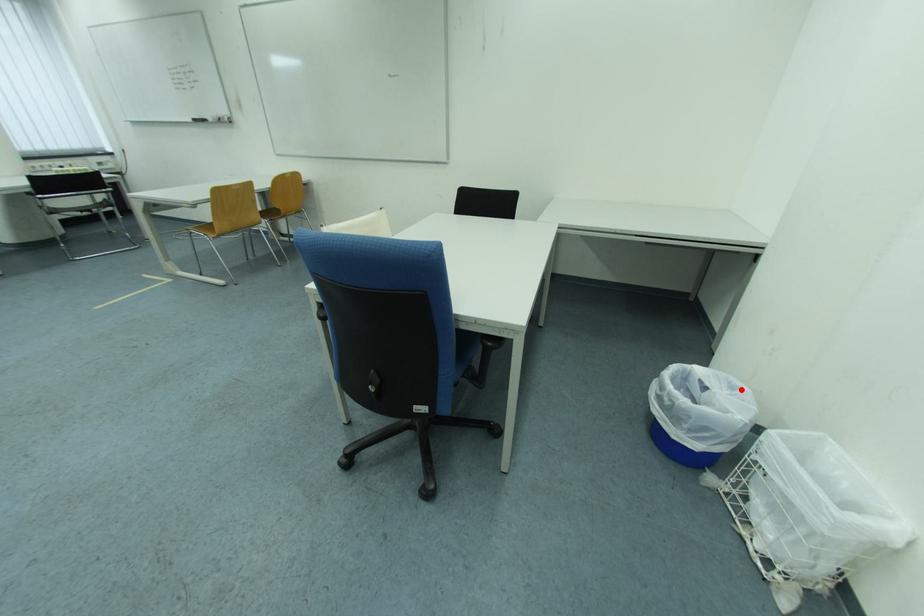
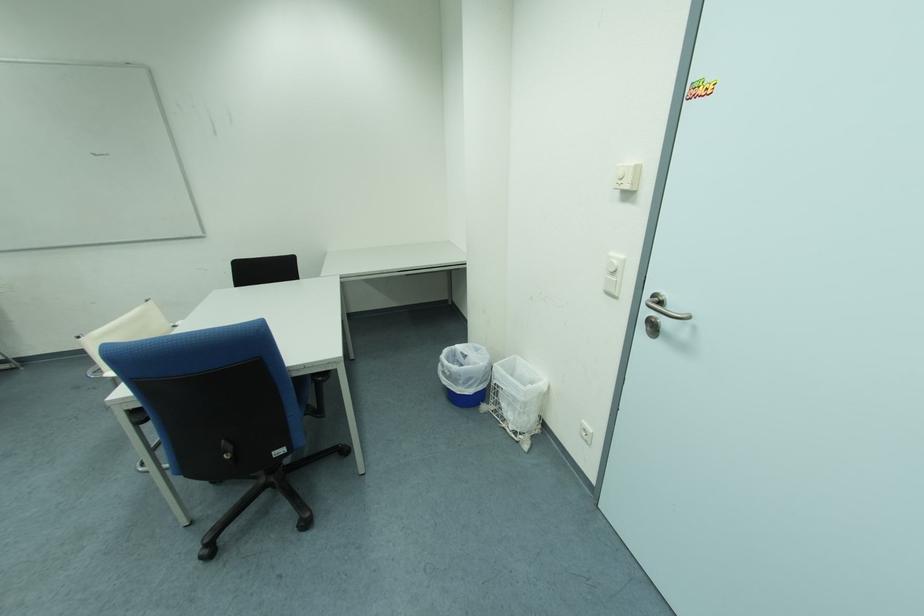
Locate, in the second image, the point that corresponds to the highlighted location in the first image.

(485, 352)